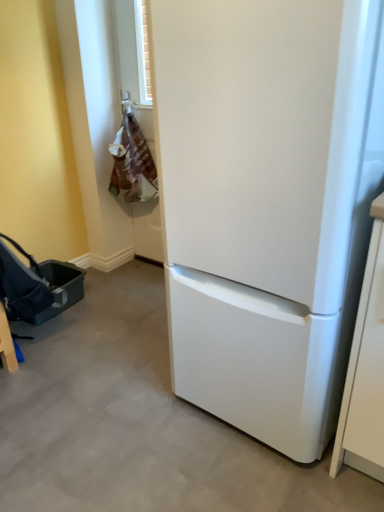
Identify the location of white matte refrigerator at center. (267, 203).

Describe the element at coordinates (267, 203) in the screenshot. This screenshot has width=384, height=512. I see `white matte refrigerator at center` at that location.

Image resolution: width=384 pixels, height=512 pixels. What are the coordinates of `white matte refrigerator at center` in the screenshot? It's located at (267, 203).